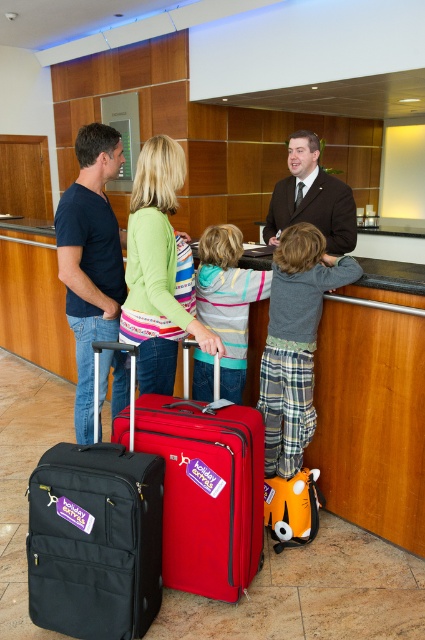
Question: Which point is closer to the camera?

Choices:
 (A) (71, 589)
 (B) (96, 260)
 (C) (243, 301)

Answer: (A)

Question: Is matte red suitcase at center to the left of green striped sweater at center from the viewer's perspective?

Choices:
 (A) no
 (B) yes

Answer: (A)

Question: Which object is the closest to the striped hoodie at center?

Choices:
 (A) green striped sweater at center
 (B) dark brown suit at center
 (C) matte black suitcase at center

Answer: (A)

Question: Where is black fabric suitcase at lower left located in relation to green striped sweater at center in the image?

Choices:
 (A) below
 (B) above

Answer: (A)

Question: Considering the real-world distances, which object is farthest from the gray flannel pajama pants at center?

Choices:
 (A) matte black suitcase at center
 (B) black fabric suitcase at lower left

Answer: (B)

Question: Is matte black suitcase at center to the right of gray flannel pajama pants at center from the viewer's perspective?

Choices:
 (A) no
 (B) yes

Answer: (A)